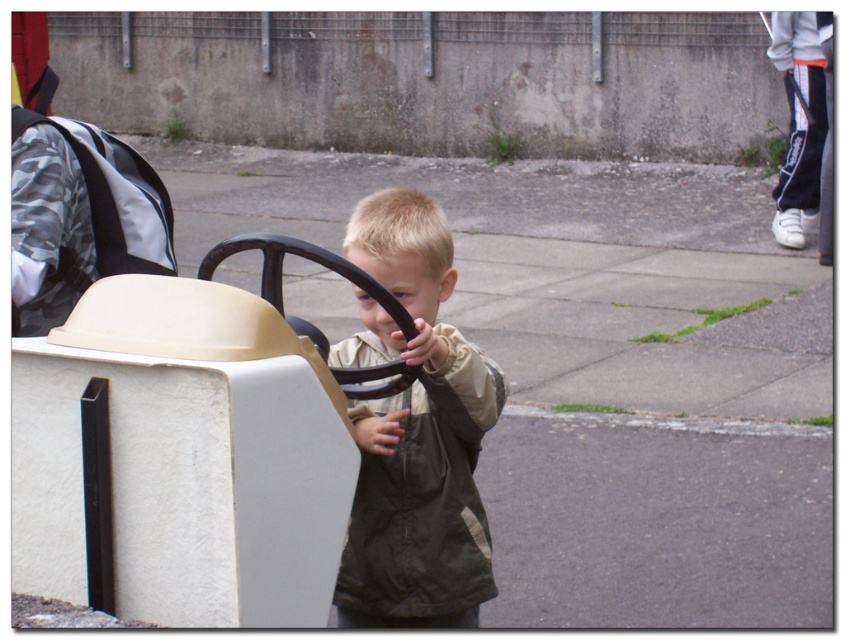
Who is shorter, khaki fabric jacket at center or beige plastic steering wheel at center?

Standing shorter between the two is beige plastic steering wheel at center.

Can you confirm if khaki fabric jacket at center is positioned to the right of beige plastic steering wheel at center?

Yes, khaki fabric jacket at center is to the right of beige plastic steering wheel at center.

Describe the element at coordinates (413, 433) in the screenshot. I see `khaki fabric jacket at center` at that location.

Where is `khaki fabric jacket at center`? khaki fabric jacket at center is located at coordinates (413, 433).